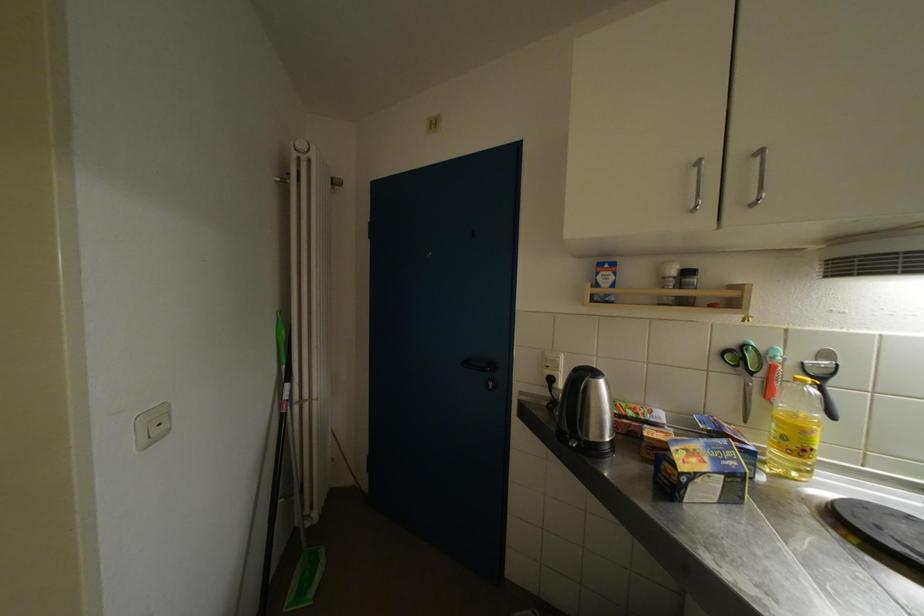
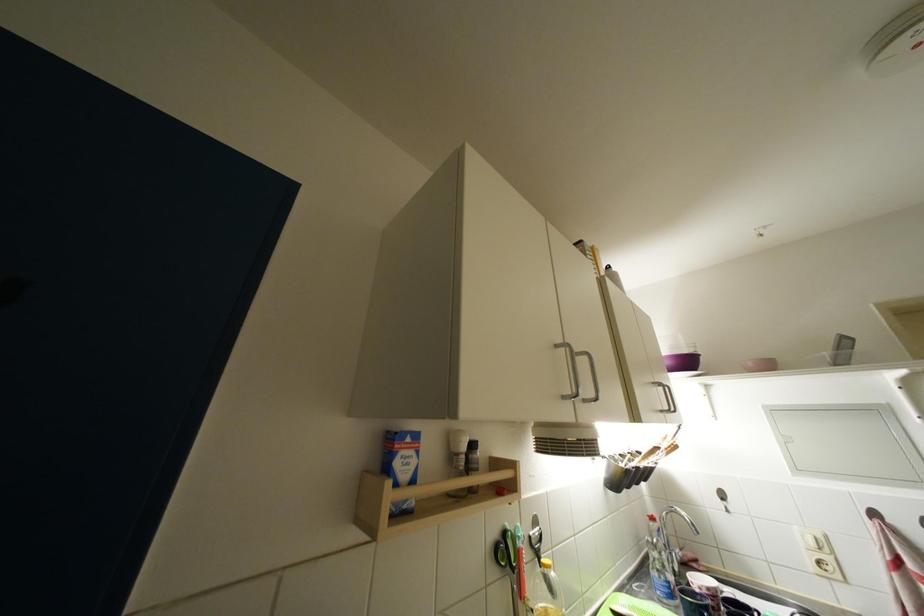
The first image is from the beginning of the video and the second image is from the end. How did the camera likely rotate when shooting the video?

The camera's rotation is toward right-up.